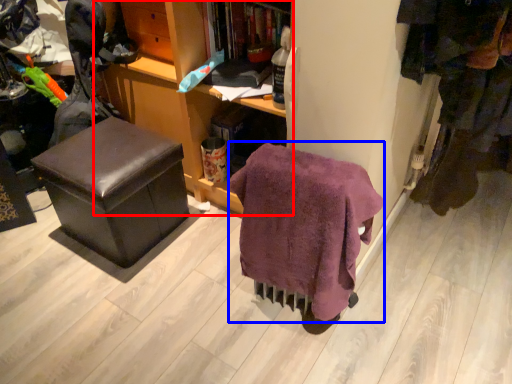
Question: Among these objects, which one is farthest to the camera, cabinetry (highlighted by a red box) or blanket (highlighted by a blue box)?

Choices:
 (A) cabinetry
 (B) blanket

Answer: (A)